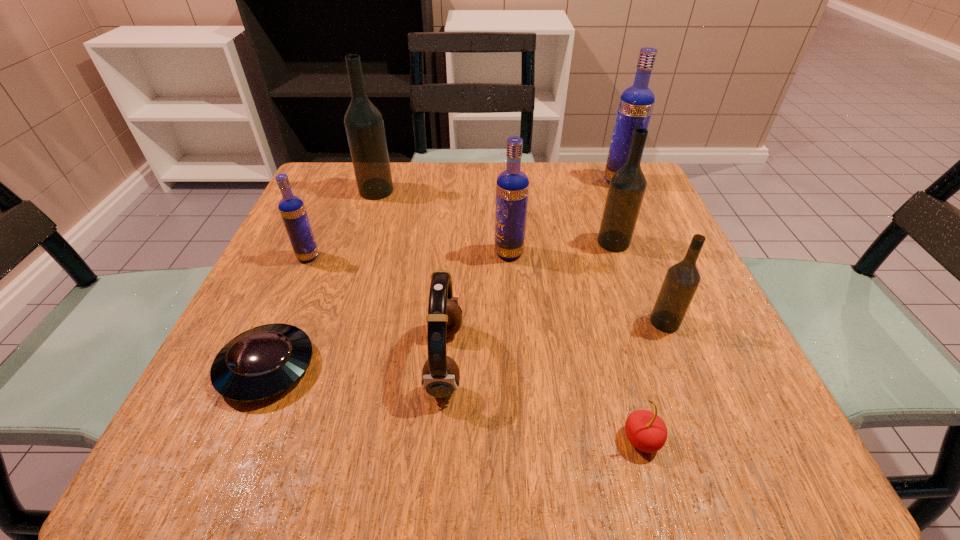
This screenshot has width=960, height=540. Find the location of `the biggest blue vodka`. the biggest blue vodka is located at coordinates (636, 103).

At what (x,y) coordinates should I click in order to perform the action: click on the farthest blue vodka. Please return your answer as a coordinate pair (x, y). The height and width of the screenshot is (540, 960). Looking at the image, I should click on (636, 103).

This screenshot has height=540, width=960. What are the coordinates of `the leftmost black vodka` in the screenshot? It's located at (364, 125).

You are a GUI agent. You are given a task and a screenshot of the screen. Output one action in this format:
    pyautogui.click(x=<x>, y=<y>)
    Task: Click on the farthest black vodka
    
    Given the screenshot: What is the action you would take?
    pyautogui.click(x=364, y=125)

Find the location of a particular element. Image resolution: width=960 pixels, height=540 pixels. the fourth vodka from right to left is located at coordinates (512, 186).

The image size is (960, 540). In order to click on the second smallest blue vodka in this screenshot , I will do `click(512, 186)`.

What are the coordinates of `the second biggest black vodka` in the screenshot? It's located at (627, 187).

Where is `the leftmost vodka`? The width and height of the screenshot is (960, 540). the leftmost vodka is located at coordinates tap(292, 209).

Find the location of `the leftmost blue vodka`. the leftmost blue vodka is located at coordinates (292, 209).

The height and width of the screenshot is (540, 960). In order to click on the nearest vodka in this screenshot , I will do point(681,281).